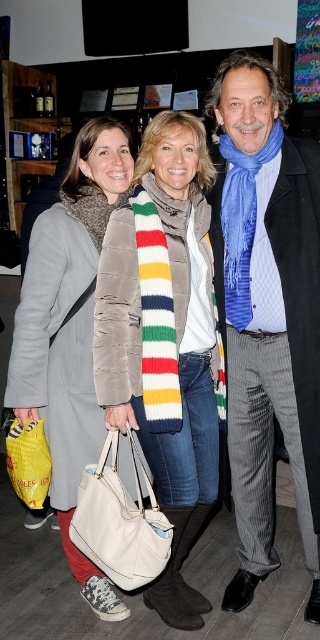
You are standing at the entrance of the venue and want to move towards the point labeled as point [166,561]. However, there is an obstacle at point [24,502]. Will you encounter this obstacle before reaching your destination?

Yes, you will encounter the obstacle at point [24,502] before reaching point [166,561] because point [166,561] is in front of point [24,502].

What is located at the coordinates point (165,340)?

The striped wool scarf at center is located at point (165,340).

You are at a social event and need to locate your belongings. You have a white leather handbag at center and a yellow fabric bag at lower left. Which bag is positioned closer to the right side of the image?

The white leather handbag at center is positioned to the right of the yellow fabric bag at lower left, so it is closer to the right side of the image.